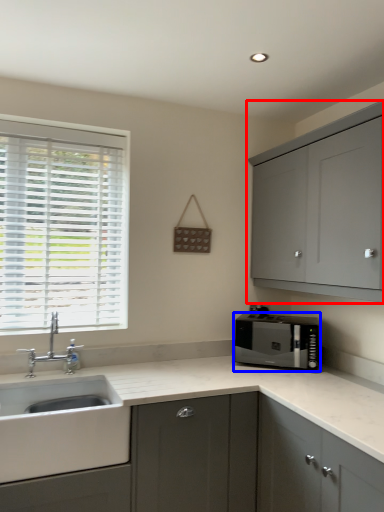
Question: Which point is further to the camera, cabinetry (highlighted by a red box) or microwave oven (highlighted by a blue box)?

Choices:
 (A) cabinetry
 (B) microwave oven

Answer: (B)